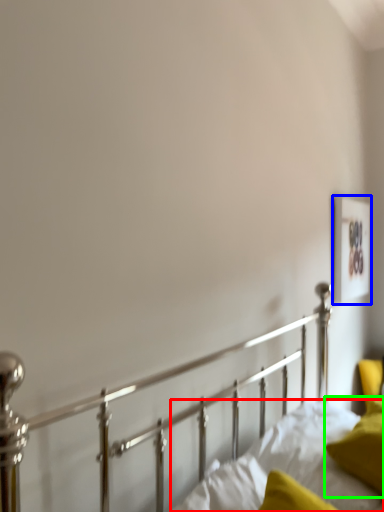
Question: Which object is positioned closest to mattress (highlighted by a red box)? Select from picture frame (highlighted by a blue box) and pillow (highlighted by a green box).

Choices:
 (A) picture frame
 (B) pillow

Answer: (B)